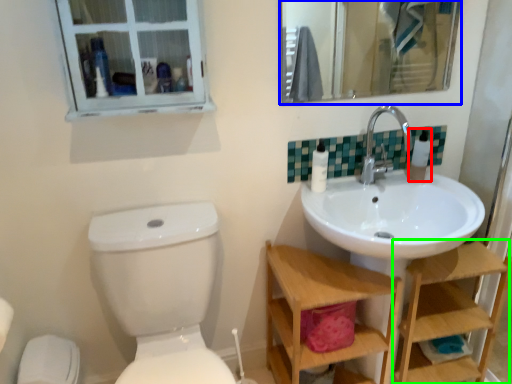
Question: Which object is the closest to the toiletry (highlighted by a red box)? Choose among these: mirror (highlighted by a blue box) or shelf (highlighted by a green box).

Choices:
 (A) mirror
 (B) shelf

Answer: (B)